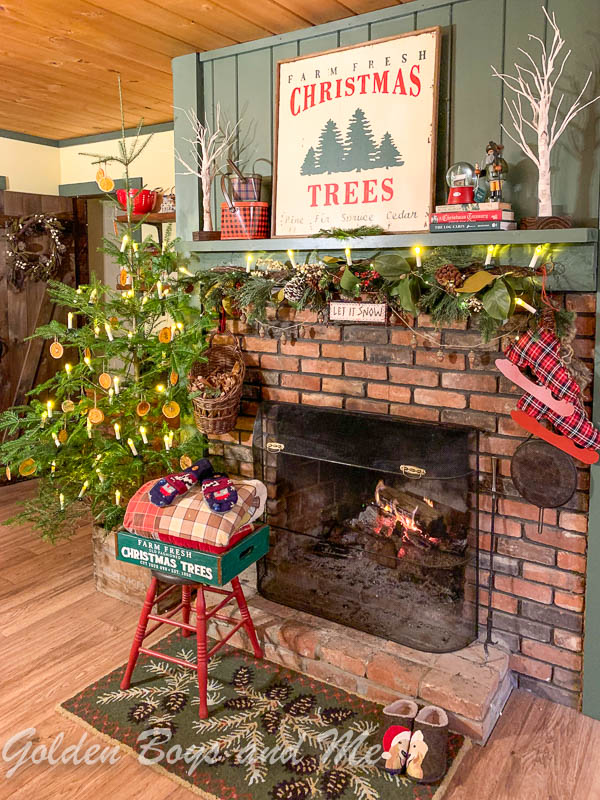
Locate an element on the screen. Image resolution: width=600 pixels, height=800 pixels. fire logs is located at coordinates (431, 525), (449, 514).